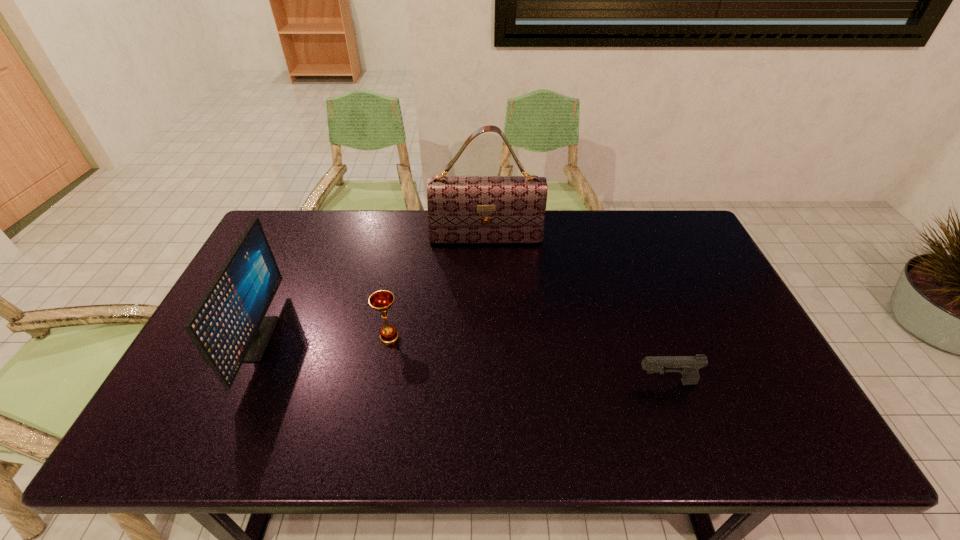
Where is `vacant space located on the left of the third object from right to left`? The image size is (960, 540). vacant space located on the left of the third object from right to left is located at coordinates [x=232, y=336].

You are a GUI agent. You are given a task and a screenshot of the screen. Output one action in this format:
    pyautogui.click(x=<x>, y=<y>)
    Task: Click on the vacant space located at the barrel of the shortest object
    This screenshot has width=960, height=540.
    Given the screenshot: What is the action you would take?
    (525, 382)

Where is `free space located 0.230m at the barrel of the shortest object`? This screenshot has width=960, height=540. free space located 0.230m at the barrel of the shortest object is located at coordinates (541, 382).

Find the location of a particular element. This screenshot has width=960, height=540. vacant space located at the barrel of the shortest object is located at coordinates (599, 382).

Where is `object located at the far edge`? Image resolution: width=960 pixels, height=540 pixels. object located at the far edge is located at coordinates (461, 209).

Find the location of a particular element. object at the left edge is located at coordinates pos(228,326).

In the image, there is a desktop. At what (x,y) coordinates should I click in order to perform the action: click on vacant space at the far edge. Please return your answer as a coordinate pair (x, y). The width and height of the screenshot is (960, 540). Looking at the image, I should click on pos(442,246).

Locate an element on the screen. The image size is (960, 540). free region at the near edge of the desktop is located at coordinates (660, 442).

Locate an element on the screen. The width and height of the screenshot is (960, 540). vacant region at the left edge is located at coordinates (231, 390).

The image size is (960, 540). Find the location of `vacant space at the far left corner of the desktop`. vacant space at the far left corner of the desktop is located at coordinates (276, 252).